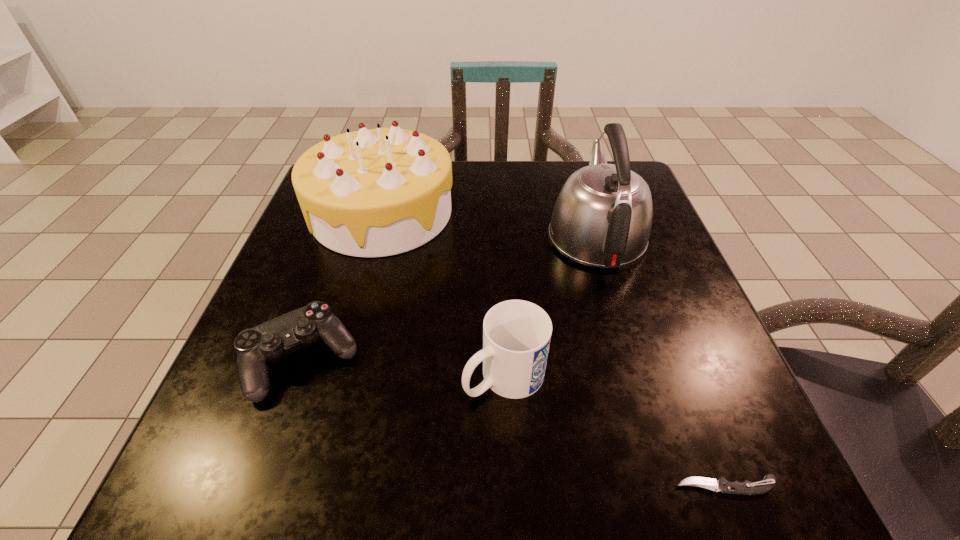
Where is `free space in the image that satisfies the following two spatial constraints: 1. on the front side of the third shortest object; 2. on the right side of the shortest object`? This screenshot has width=960, height=540. free space in the image that satisfies the following two spatial constraints: 1. on the front side of the third shortest object; 2. on the right side of the shortest object is located at coordinates (509, 485).

The image size is (960, 540). Find the location of `blank area in the image that satisfies the following two spatial constraints: 1. on the front side of the third object from left to right; 2. on the left side of the nearest object`. blank area in the image that satisfies the following two spatial constraints: 1. on the front side of the third object from left to right; 2. on the left side of the nearest object is located at coordinates (509, 485).